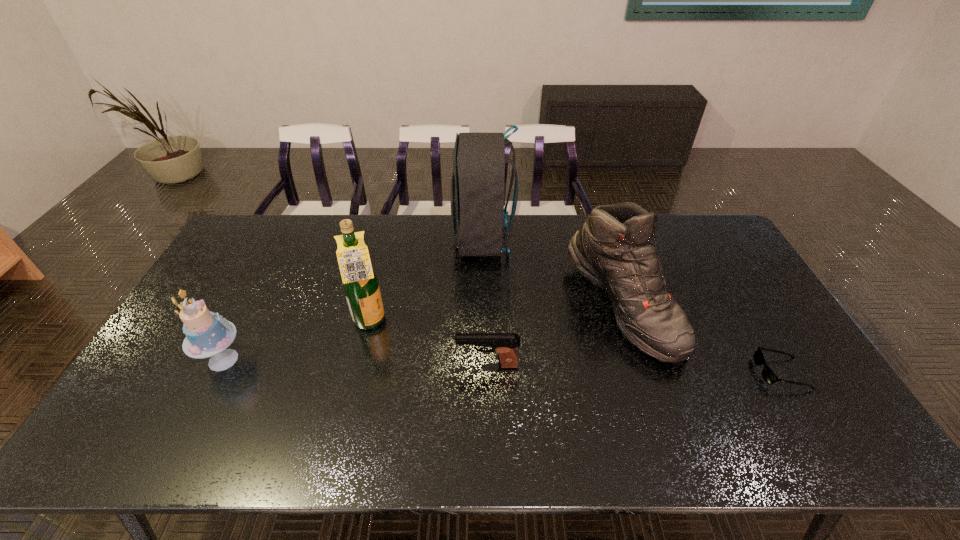
The width and height of the screenshot is (960, 540). In order to click on backpack positioned at the far edge in this screenshot , I will do `click(478, 180)`.

Locate an element on the screen. The image size is (960, 540). ski boot located in the far edge section of the desktop is located at coordinates (614, 249).

Where is `object at the left edge`? object at the left edge is located at coordinates (207, 334).

Where is `object located in the right edge section of the desktop`? The height and width of the screenshot is (540, 960). object located in the right edge section of the desktop is located at coordinates (768, 375).

In the image, there is a desktop. Where is `vacant area at the far edge`? The image size is (960, 540). vacant area at the far edge is located at coordinates 345,217.

In the image, there is a desktop. Find the location of `vacant space at the near edge`. vacant space at the near edge is located at coordinates (420, 436).

In the image, there is a desktop. At what (x,y) coordinates should I click in order to perform the action: click on vacant space at the left edge. Please return your answer as a coordinate pair (x, y). The width and height of the screenshot is (960, 540). Looking at the image, I should click on (247, 286).

This screenshot has width=960, height=540. I want to click on vacant space at the right edge, so click(x=716, y=305).

Locate an element on the screen. The width and height of the screenshot is (960, 540). vacant area that lies between the second object from left to right and the pistol is located at coordinates (429, 344).

Where is `free space between the fifth object from left to right and the liquor`? This screenshot has height=540, width=960. free space between the fifth object from left to right and the liquor is located at coordinates (496, 314).